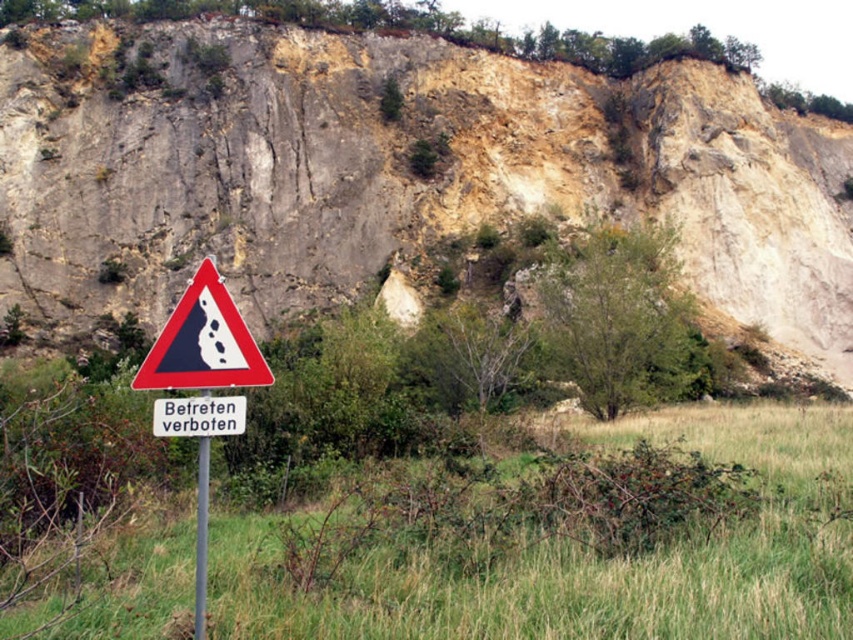
You are standing at the base of the cliff and want to place a new sign exactly 1 meter to the right of the black glossy triangle at center. Given that the coordinate system uses the bottom left corner of the image as the origin, what are the new coordinates for the center of the new sign?

The new coordinates would be approximately (202, 342) plus 1 meter in the x direction. However, without knowing the scale of the coordinate system, we cannot determine the exact coordinates in meters. The question requires knowing the scale between the coordinate system and real world measurements.

Based on the photo, you are standing at the base of the rough stone cliff at upper center and want to place a flag exactly halfway between you and the top of the cliff. How far will the flag be from the top?

The flag will be 129.9 feet away from the top of the rough stone cliff at upper center because the total distance between the base and the top is 259.80 feet, so half of that distance is 129.9 feet.